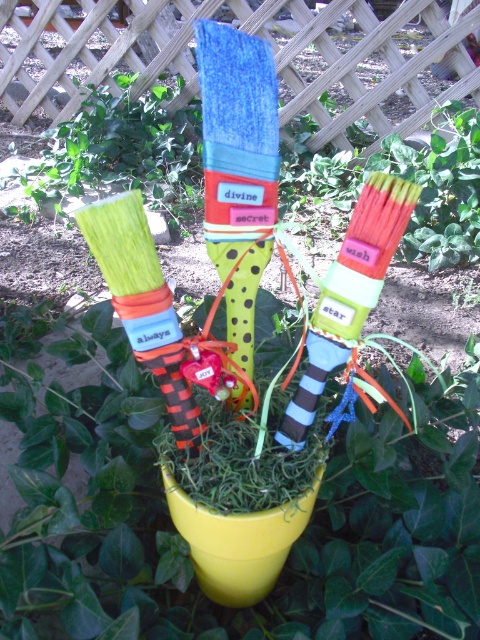
Question: Does matte green paintbrush at center appear over green polka dot sock at center?

Choices:
 (A) no
 (B) yes

Answer: (A)

Question: Does matte green paintbrush at center have a lesser width compared to green polka dot sock at center?

Choices:
 (A) no
 (B) yes

Answer: (A)

Question: Among these points, which one is nearest to the camera?

Choices:
 (A) (206, 33)
 (B) (72, 339)

Answer: (A)

Question: Does matte green paintbrush at center have a smaller size compared to green polka dot sock at center?

Choices:
 (A) yes
 (B) no

Answer: (B)